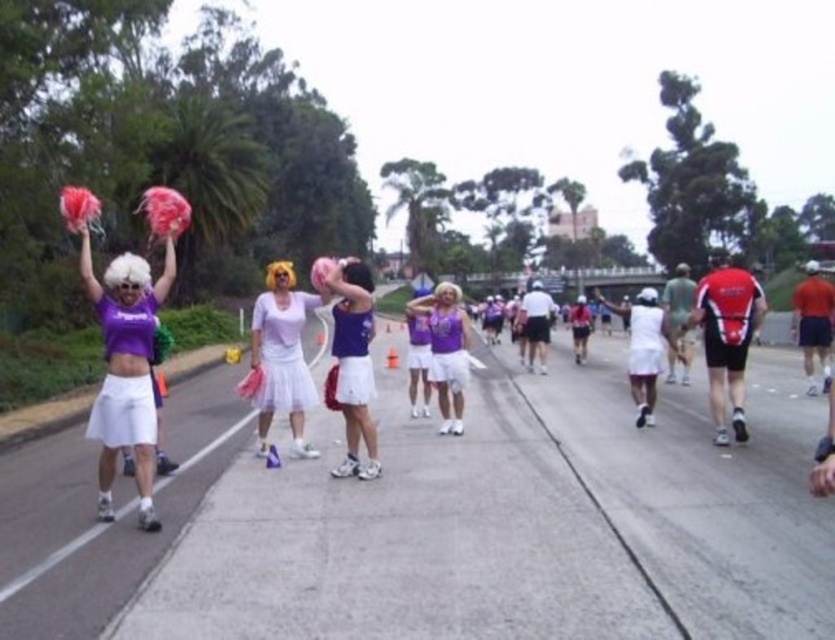
You are a photographer trying to capture a wide shot of the event. You notice the white asphalt road at center and the red fabric shirt at right. Which object appears narrower in the image?

The white asphalt road at center appears narrower than the red fabric shirt at right in the image.

What is the 2D coordinate of the white asphalt road at center?

The white asphalt road at center is located at the 2D coordinate point of (522, 522).